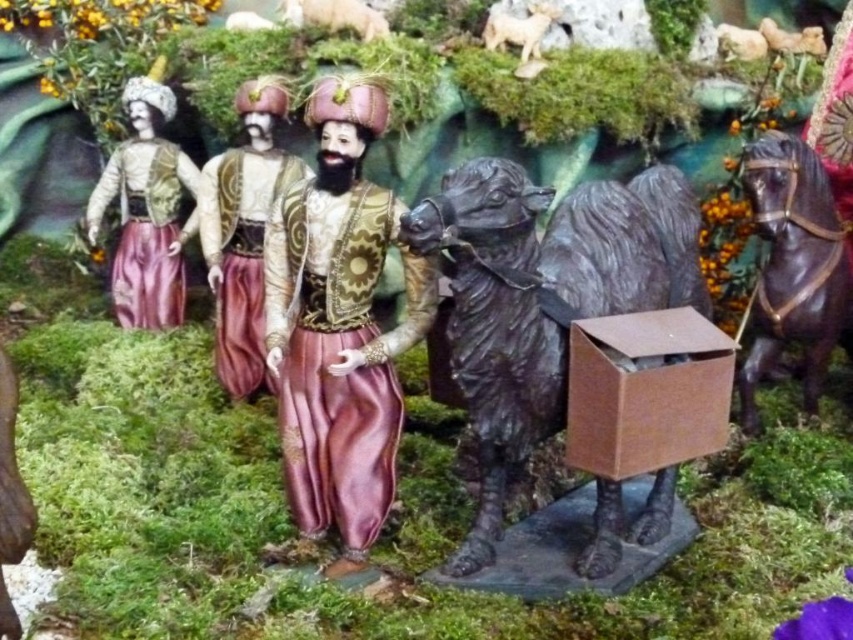
Question: Does shiny gold vest at center have a greater width compared to shiny brown horse at right?

Choices:
 (A) yes
 (B) no

Answer: (B)

Question: Is shiny brown horse at right further to camera compared to white woolen sheep at upper center?

Choices:
 (A) no
 (B) yes

Answer: (A)

Question: Is shiny brown horse at right wider than white woolly sheep at upper center?

Choices:
 (A) no
 (B) yes

Answer: (B)

Question: Which of these objects is positioned farthest from the matte gold fabric at left?

Choices:
 (A) shiny brown horse at right
 (B) brown cardboard box at center

Answer: (A)

Question: Based on their relative distances, which object is nearer to the brown matte camel at center?

Choices:
 (A) matte gold fabric at left
 (B) brown cardboard box at center
 (C) white woolen sheep at upper center

Answer: (B)

Question: Which is nearer to the matte gold fabric at left?

Choices:
 (A) brown fuzzy goat at upper right
 (B) matte gold fabric at center

Answer: (B)